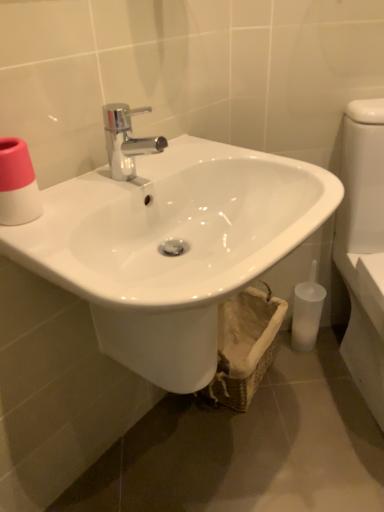
Question: Looking at their shapes, would you say pink matte toilet paper at upper left is wider or thinner than white glossy sink at center?

Choices:
 (A) thin
 (B) wide

Answer: (A)

Question: Is pink matte toilet paper at upper left inside or outside of white glossy sink at center?

Choices:
 (A) outside
 (B) inside

Answer: (A)

Question: Estimate the real-world distances between objects in this image. Which object is farther from the translucent plastic toilet brush at lower right?

Choices:
 (A) pink matte toilet paper at upper left
 (B) woven beige basket at lower center
 (C) white glossy toilet at right
 (D) white glossy sink at center

Answer: (A)

Question: Which object is positioned closest to the white glossy toilet at right?

Choices:
 (A) woven beige basket at lower center
 (B) white glossy sink at center
 (C) pink matte toilet paper at upper left
 (D) translucent plastic toilet brush at lower right

Answer: (D)